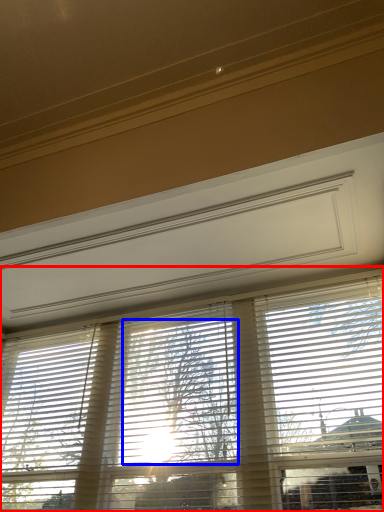
Question: Which of the following is the closest to the observer, window blind (highlighted by a red box) or tree (highlighted by a blue box)?

Choices:
 (A) window blind
 (B) tree

Answer: (A)